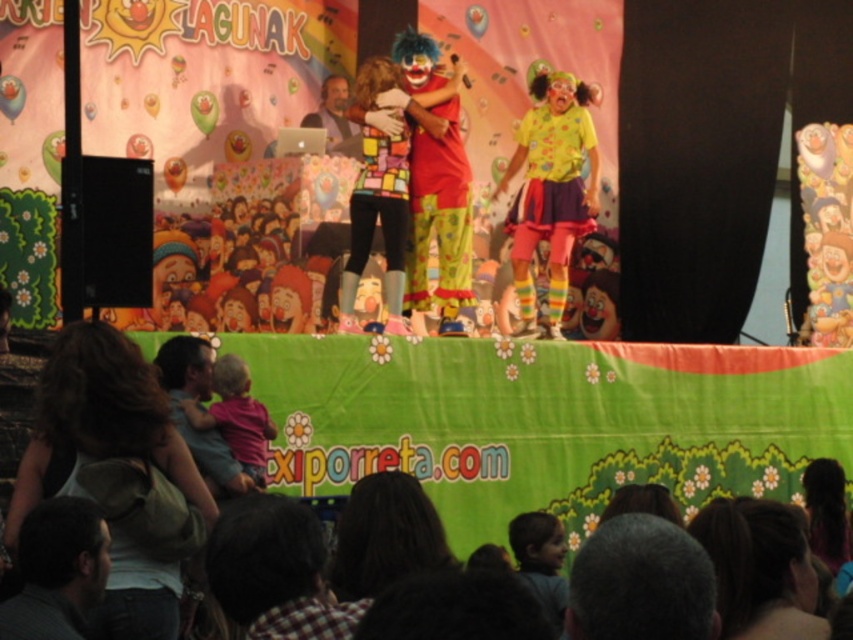
You are a stagehand standing behind the stage. You need to move a ladder to reach the dark brown hair at lower left and yellow polka dot shirt at center. The ladder is 3 meters long. Can you reach both objects with this ladder?

The dark brown hair at lower left is 38.55 meters from the yellow polka dot shirt at center. Since the ladder is only 3 meters long, it is impossible to reach both objects as the distance between them exceeds the ladder length.

Looking at this image, you are a photographer at the back of the audience. You want to take a photo of the dark brown hair at lower left and the gray fabric shirt at lower left. Which object should you focus on first if you want to capture both in one shot without moving the camera?

The dark brown hair at lower left is taller than the gray fabric shirt at lower left, so you should focus on the dark brown hair at lower left first to ensure both are in focus.

You are a photographer setting up for a photo shoot at the event. You have to position your camera so that both the gray fabric shirt at lower left and the matte gray laptop at center are in frame. Which object should you ensure is in focus first to account for their size difference?

The gray fabric shirt at lower left has a greater height compared to the matte gray laptop at center, so you should focus on the gray fabric shirt at lower left first to ensure its details are sharp before adjusting for the smaller laptop.